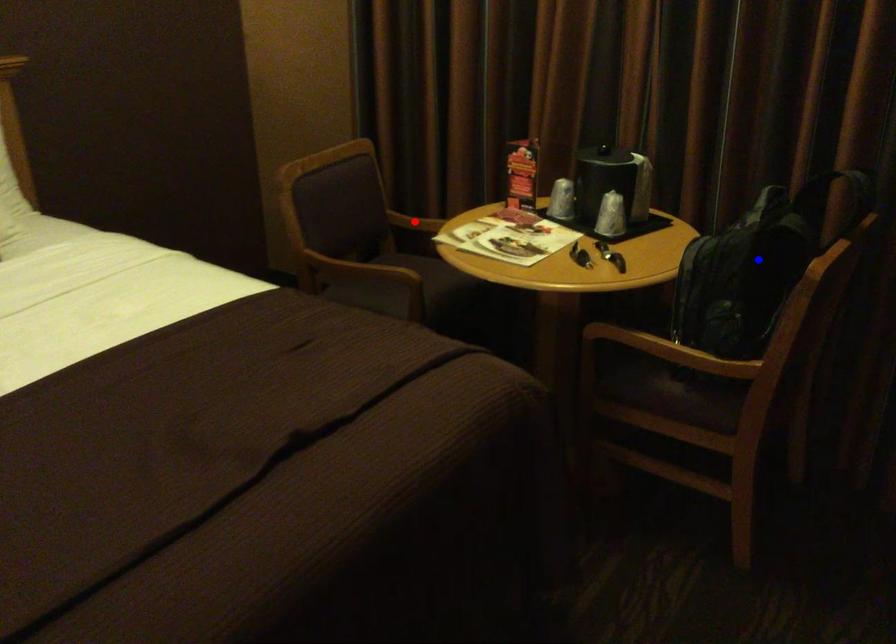
Question: Which of the two points in the image is closer to the camera?

Choices:
 (A) Blue point is closer.
 (B) Red point is closer.

Answer: (A)